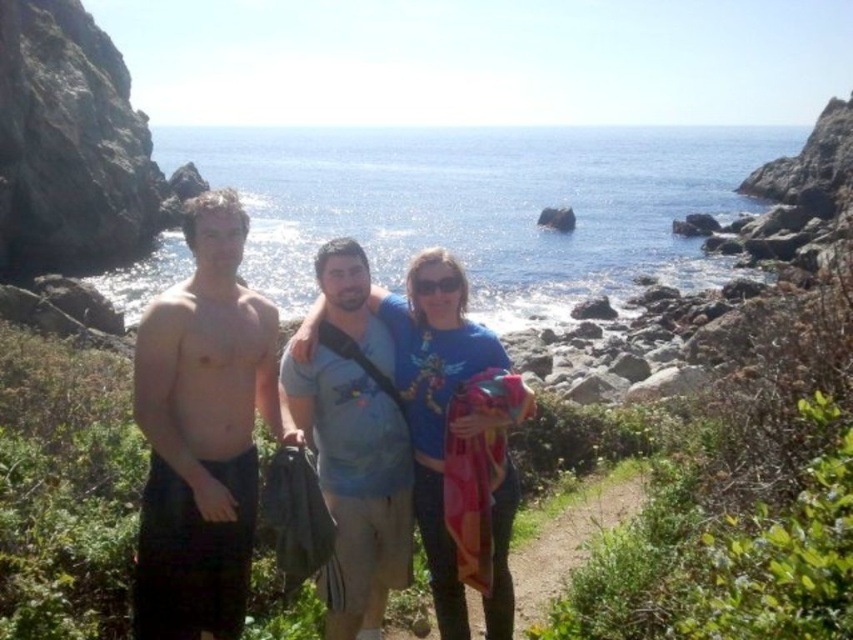
This screenshot has height=640, width=853. Describe the element at coordinates (202, 432) in the screenshot. I see `dark brown shorts at left` at that location.

Is dark brown shorts at left wider than shiny blue shirt at center?

No, dark brown shorts at left is not wider than shiny blue shirt at center.

Which is behind, point (198, 484) or point (430, 429)?

Positioned behind is point (430, 429).

Locate an element on the screen. This screenshot has width=853, height=640. dark brown shorts at left is located at coordinates (202, 432).

Does shiny blue shirt at center have a smaller size compared to dirt path at center?

Incorrect, shiny blue shirt at center is not smaller in size than dirt path at center.

The height and width of the screenshot is (640, 853). What do you see at coordinates (437, 396) in the screenshot? I see `shiny blue shirt at center` at bounding box center [437, 396].

This screenshot has width=853, height=640. Identify the location of shiny blue shirt at center. (437, 396).

Between point (228, 228) and point (502, 548), which one is positioned in front?

Point (228, 228) is more forward.

Is dark brown shorts at left positioned at the back of blue cotton shirt at center?

No, dark brown shorts at left is in front of blue cotton shirt at center.

Is point (180, 472) positioned behind point (451, 637)?

No, (180, 472) is closer to viewer.

I want to click on dark brown shorts at left, so click(x=202, y=432).